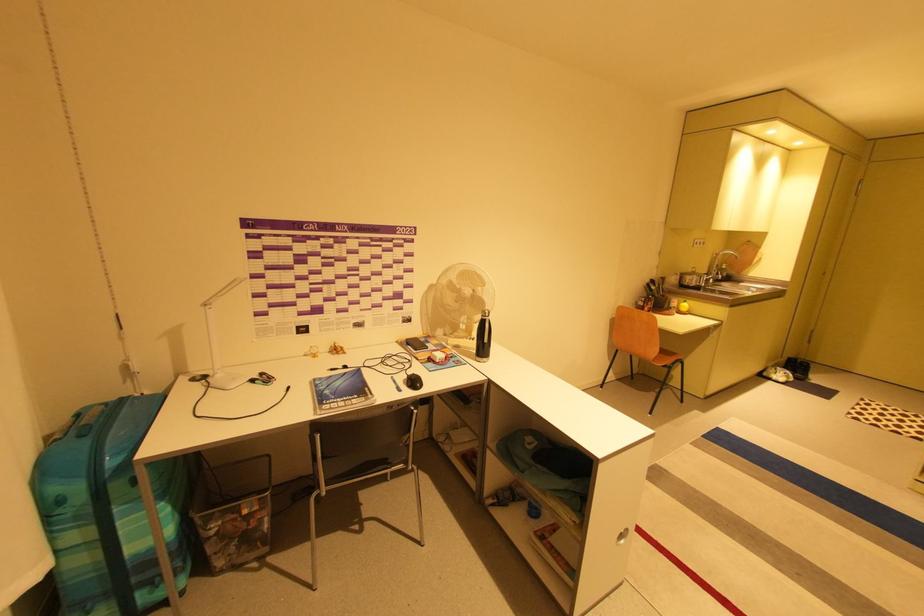
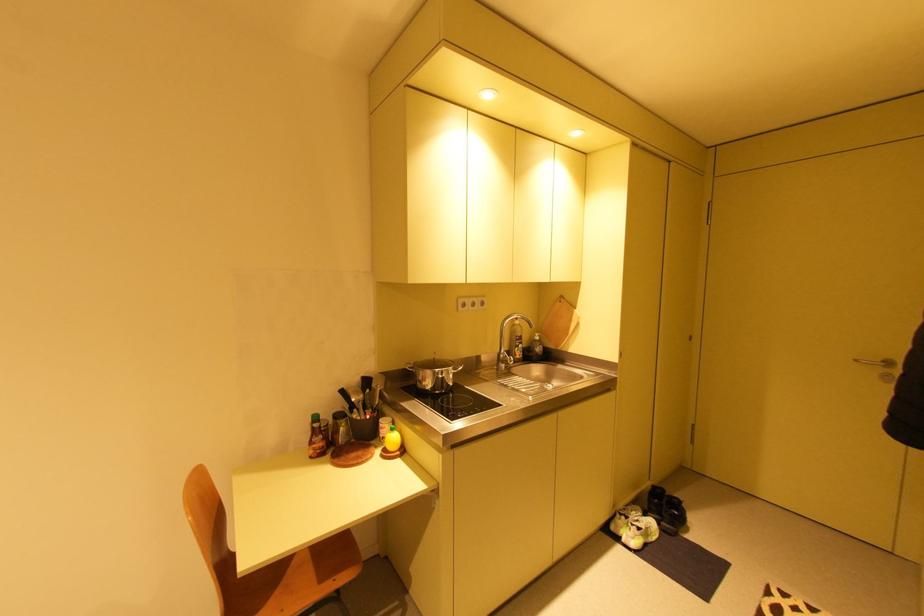
Locate, in the second image, the point that corresponds to point 774,379 in the first image.

(623, 538)